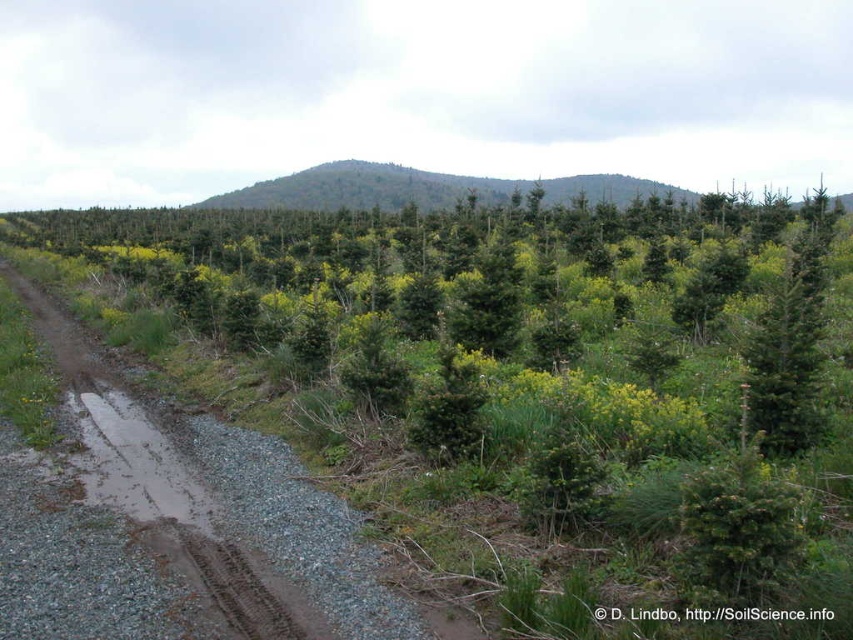
Question: Which point is closer to the camera?

Choices:
 (A) (397, 200)
 (B) (283, 499)

Answer: (B)

Question: Can you confirm if brown gravel road at left is positioned below green forested mountain at center?

Choices:
 (A) yes
 (B) no

Answer: (A)

Question: Can you confirm if brown gravel road at left is wider than green forested mountain at center?

Choices:
 (A) yes
 (B) no

Answer: (B)

Question: Where is brown gravel road at left located in relation to green forested mountain at center in the image?

Choices:
 (A) above
 (B) below

Answer: (B)

Question: Among these objects, which one is nearest to the camera?

Choices:
 (A) green forested mountain at center
 (B) brown gravel road at left

Answer: (B)

Question: Among these points, which one is nearest to the camera?

Choices:
 (A) pyautogui.click(x=444, y=179)
 (B) pyautogui.click(x=38, y=301)

Answer: (B)